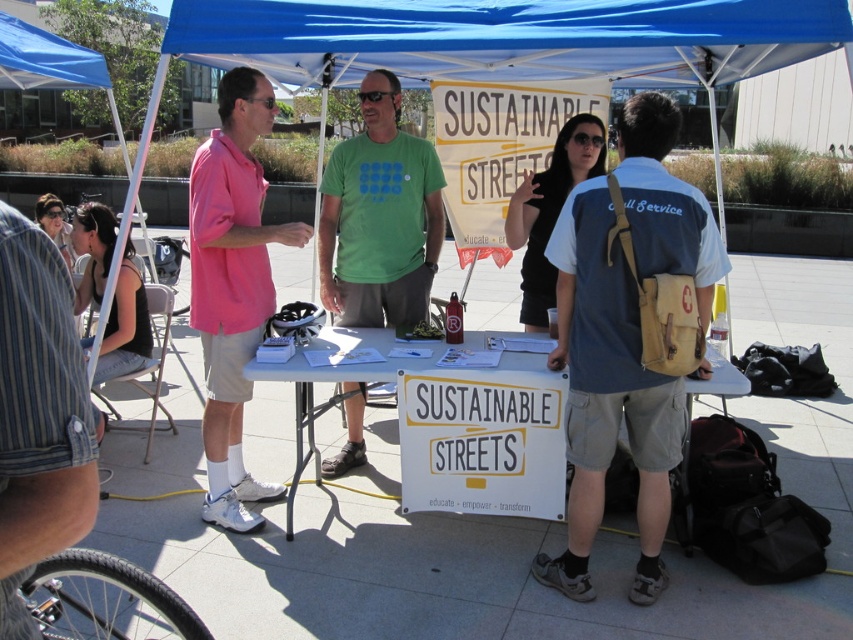
Question: Based on their relative distances, which object is nearer to the tan canvas backpack at center?

Choices:
 (A) black fabric tank top at left
 (B) pink cotton shirt at left
 (C) white paperboard sign at center
 (D) green fabric shirt at center

Answer: (C)

Question: Among these objects, which one is farthest from the camera?

Choices:
 (A) green fabric shirt at center
 (B) pink cotton shirt at left

Answer: (A)

Question: Does tan canvas backpack at center have a larger size compared to green fabric shirt at center?

Choices:
 (A) no
 (B) yes

Answer: (B)

Question: Which of the following is the farthest from the observer?

Choices:
 (A) (210, 449)
 (B) (321, 193)
 (C) (122, 314)
 (D) (445, 422)

Answer: (B)

Question: Where is tan canvas backpack at center located in relation to white paperboard sign at center in the image?

Choices:
 (A) right
 (B) left

Answer: (A)

Question: Is tan canvas backpack at center thinner than green fabric shirt at center?

Choices:
 (A) yes
 (B) no

Answer: (B)